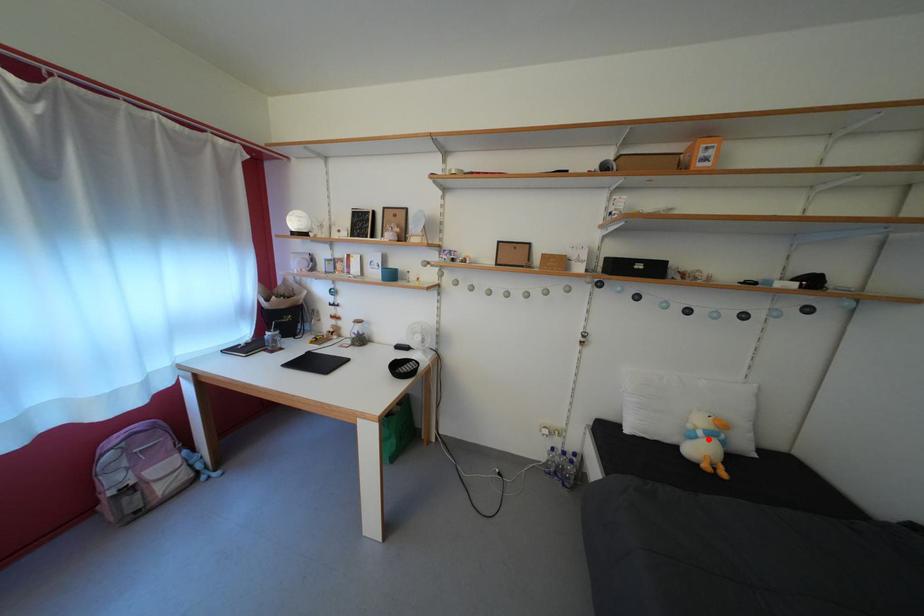
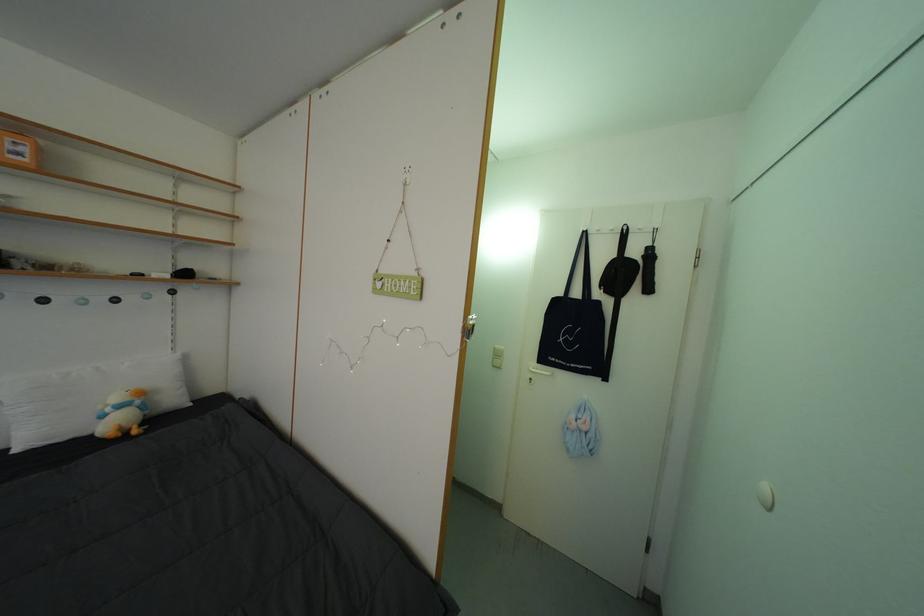
Question: I am providing you with two images of the same scene from different viewpoints. Image1 has a red point marked. In image2, the corresponding 3D location appears at what relative position? Reply with the corresponding letter.

Choices:
 (A) Closer
 (B) Farther

Answer: (A)